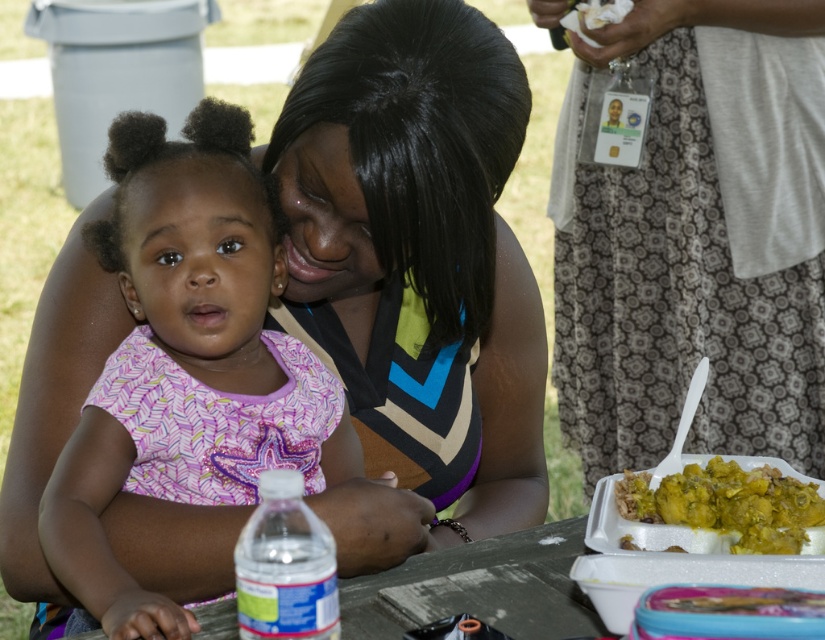
Does pink fabric dress at center have a larger size compared to yellow-green sauce-covered rice at lower right?

Yes.

Between pink fabric dress at center and yellow-green sauce-covered rice at lower right, which one appears on the left side from the viewer's perspective?

From the viewer's perspective, pink fabric dress at center appears more on the left side.

Does point (165, 124) lie behind point (776, 532)?

Yes, point (165, 124) is behind point (776, 532).

This screenshot has height=640, width=825. I want to click on pink fabric dress at center, so click(x=187, y=360).